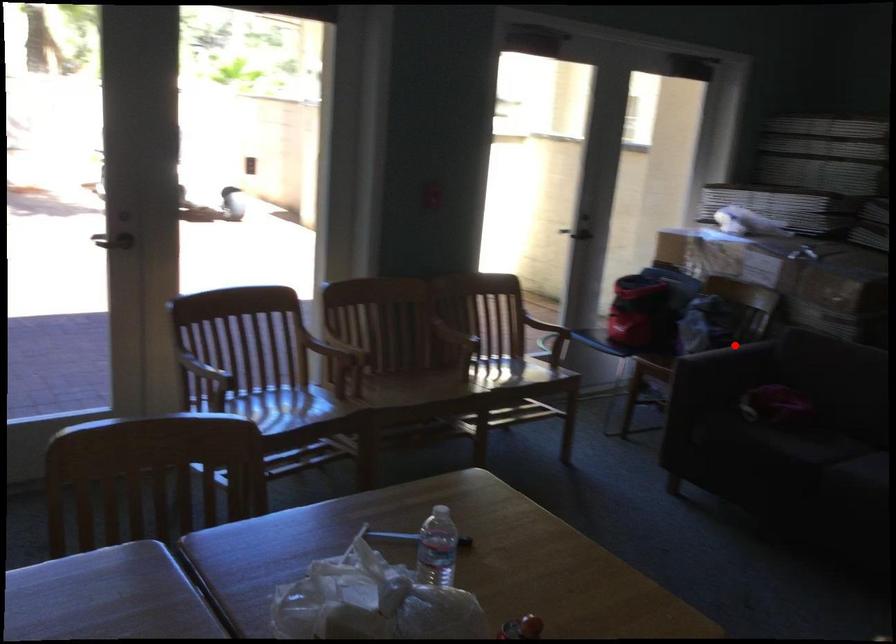
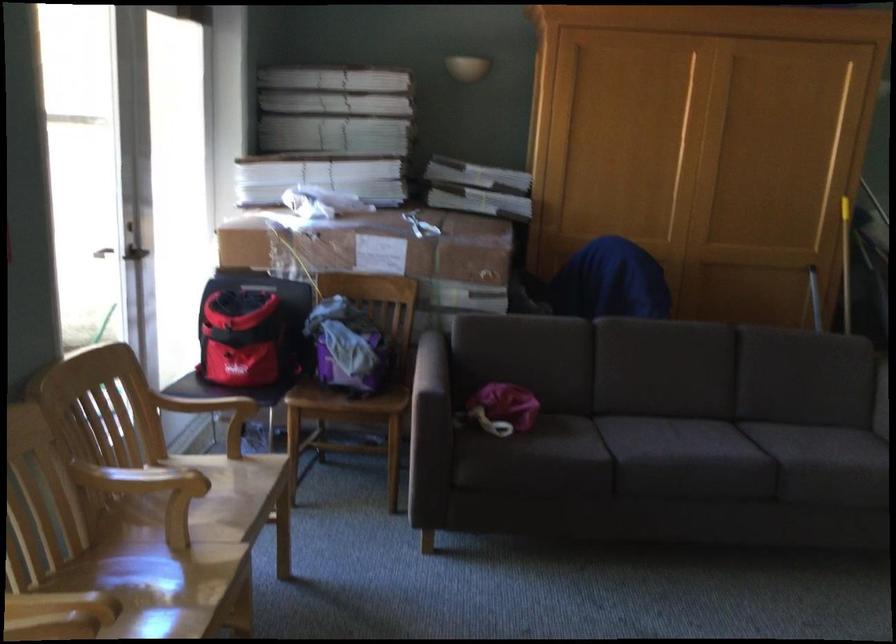
Question: I am providing you with two images of the same scene from different viewpoints. In image1, a red point is highlighted. Considering the same 3D point in image2, which of the following is correct?

Choices:
 (A) It is closer
 (B) It is farther

Answer: (A)